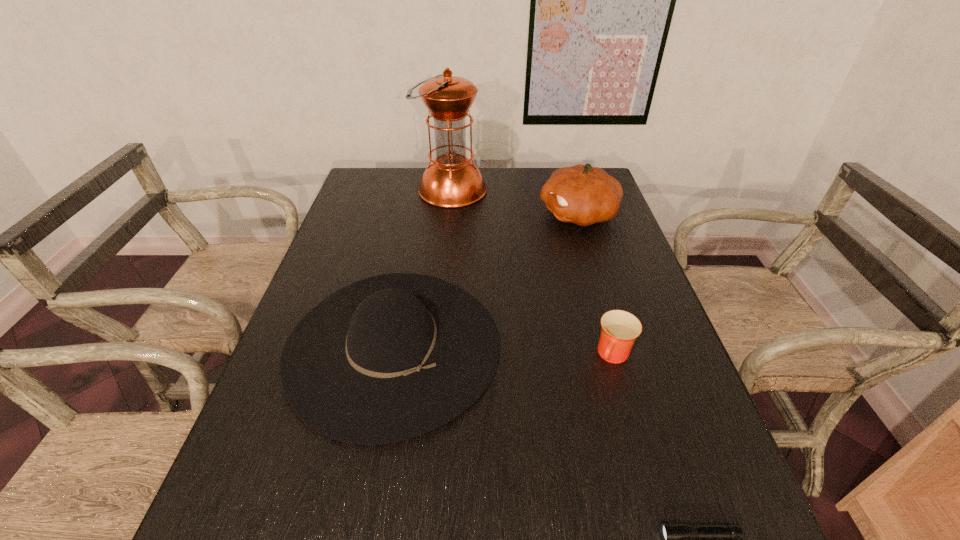
What are the coordinates of `free space between the oil lamp and the third shortest object` in the screenshot? It's located at (422, 268).

The height and width of the screenshot is (540, 960). What are the coordinates of `vacant region between the sombrero and the oil lamp` in the screenshot? It's located at (422, 268).

Identify the location of free area in between the second tallest object and the tallest object. (515, 202).

The width and height of the screenshot is (960, 540). What are the coordinates of `free area in between the second shortest object and the pumpkin` in the screenshot? It's located at (596, 285).

Where is `empty space between the cup and the fourth shortest object`? The image size is (960, 540). empty space between the cup and the fourth shortest object is located at coordinates (596, 285).

I want to click on unoccupied position between the sombrero and the tallest object, so click(422, 268).

The width and height of the screenshot is (960, 540). Identify the location of object that can be found as the closest to the third shortest object. (620, 329).

Point out which object is positioned as the fourth nearest to the cup. Please provide its 2D coordinates. Your answer should be formatted as a tuple, i.e. [(x, y)], where the tuple contains the x and y coordinates of a point satisfying the conditions above.

[(451, 180)]

Identify the location of vacant area that satisfies the following two spatial constraints: 1. on the front-facing side of the sombrero; 2. on the right side of the fourth tallest object. (392, 356).

Find the location of a particular element. Image resolution: width=960 pixels, height=540 pixels. free location that satisfies the following two spatial constraints: 1. on the front face of the pumpkin; 2. on the front side of the cup is located at coordinates (621, 356).